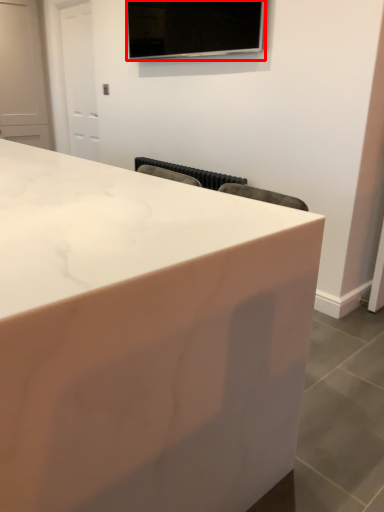
Question: From the image's perspective, considering the relative positions of television (annotated by the red box) and countertop in the image provided, where is television (annotated by the red box) located with respect to the staircase?

Choices:
 (A) above
 (B) below

Answer: (A)